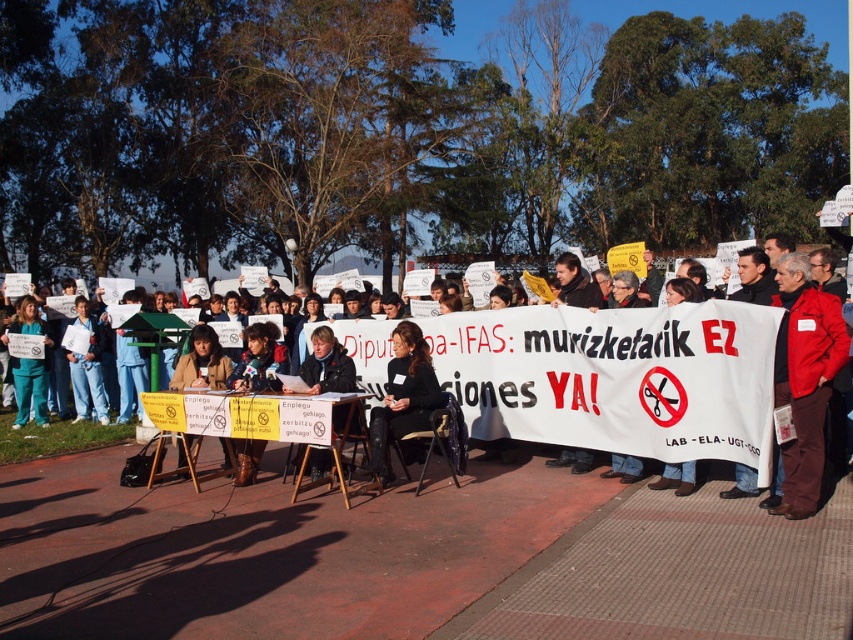
Question: Which object is the closest to the brown leather jacket at center?

Choices:
 (A) black leather pants at center
 (B) red jacket at center

Answer: (A)

Question: Is red matte jacket at right in front of brown leather boots at lower center?

Choices:
 (A) yes
 (B) no

Answer: (A)

Question: Does red jacket at center appear on the left side of red matte jacket at right?

Choices:
 (A) yes
 (B) no

Answer: (A)

Question: Which object appears closest to the camera in this image?

Choices:
 (A) matte black jacket at center
 (B) brown leather jacket at center
 (C) black leather pants at center
 (D) red jacket at center

Answer: (D)

Question: Does green scrubs at center have a lesser width compared to blue jeans at left?

Choices:
 (A) no
 (B) yes

Answer: (A)

Question: Which point is closer to the camera?

Choices:
 (A) red matte jacket at right
 (B) matte black jacket at center
 (C) red jacket at center
 (D) black leather pants at center

Answer: (A)